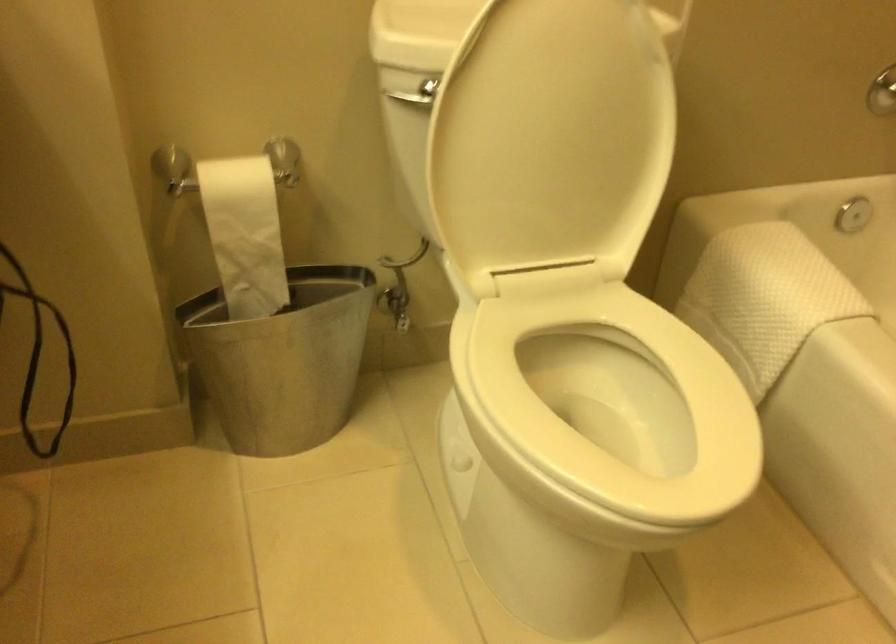
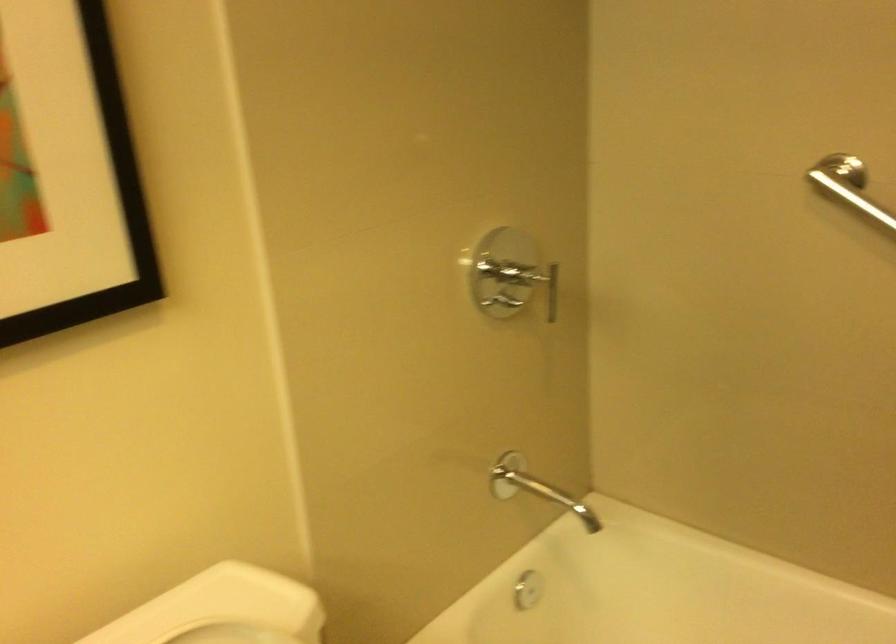
Question: The images are taken continuously from a first-person perspective. In which direction is your viewpoint rotating?

Choices:
 (A) Left
 (B) Right
 (C) Up
 (D) Down

Answer: (B)